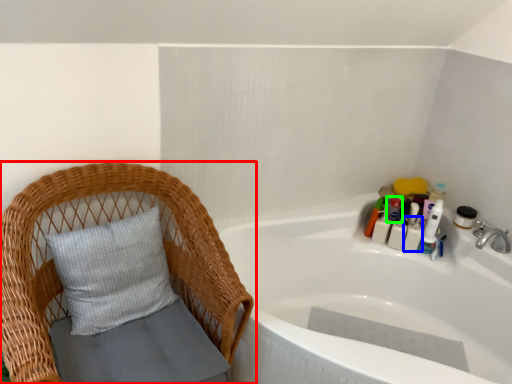
Question: Which object is the closest to the furniture (highlighted by a red box)? Choose among these: toiletry (highlighted by a blue box) or toiletry (highlighted by a green box).

Choices:
 (A) toiletry
 (B) toiletry

Answer: (B)